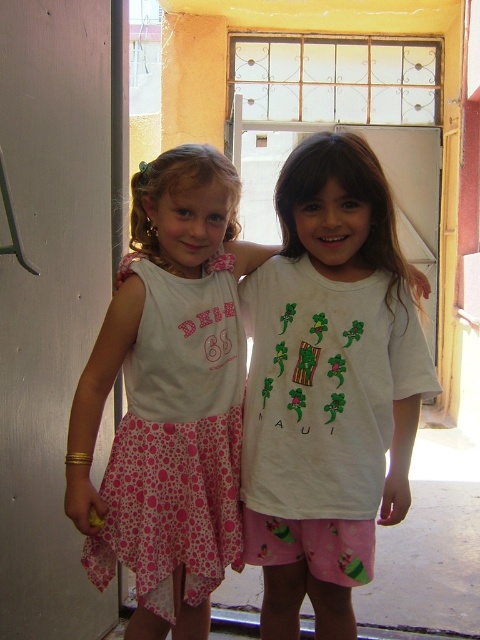
Does white cotton shirt at center have a lesser width compared to pink dotted fabric dress at left?

No.

What do you see at coordinates (132, 420) in the screenshot? This screenshot has height=640, width=480. I see `white cotton shirt at center` at bounding box center [132, 420].

Where is `white cotton shirt at center`? The height and width of the screenshot is (640, 480). white cotton shirt at center is located at coordinates (132, 420).

Who is taller, white matte door at left or pink dotted fabric dress at left?

Standing taller between the two is white matte door at left.

Image resolution: width=480 pixels, height=640 pixels. What are the coordinates of `white matte door at left` in the screenshot? It's located at click(50, 300).

Who is taller, white matte door at left or white cotton shirt at center?

Standing taller between the two is white matte door at left.

Who is positioned more to the left, white matte door at left or white cotton shirt at center?

From the viewer's perspective, white matte door at left appears more on the left side.

Identify the location of white matte door at left. Image resolution: width=480 pixels, height=640 pixels. (50, 300).

Locate an element on the screen. white matte door at left is located at coordinates (50, 300).